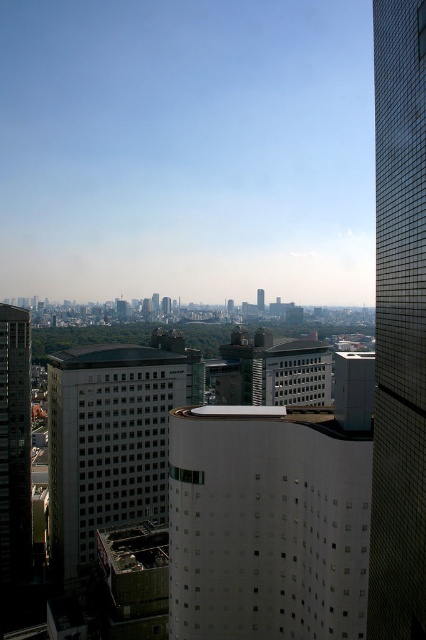
This screenshot has width=426, height=640. Identify the location of glassy reflective skyscraper at right. (399, 324).

Is point (385, 48) less distant than point (187, 385)?

That is True.

Where is `glassy reflective skyscraper at right`? This screenshot has width=426, height=640. glassy reflective skyscraper at right is located at coordinates pyautogui.click(x=399, y=324).

Locate an element on the screen. This screenshot has height=640, width=426. glassy reflective skyscraper at right is located at coordinates (399, 324).

Is point (339, 624) positioned behind point (414, 492)?

That is True.

Can you confirm if white smooth building at center is thinner than glassy reflective skyscraper at right?

In fact, white smooth building at center might be wider than glassy reflective skyscraper at right.

Which is in front, point (325, 605) or point (414, 273)?

Point (414, 273) is more forward.

Identify the location of white smooth building at center. (267, 524).

Is white smooth building at center taller than white glass building at center?

No, white smooth building at center is not taller than white glass building at center.

Identify the location of white smooth building at center. (267, 524).

This screenshot has height=640, width=426. Identify the location of white smooth building at center. (267, 524).